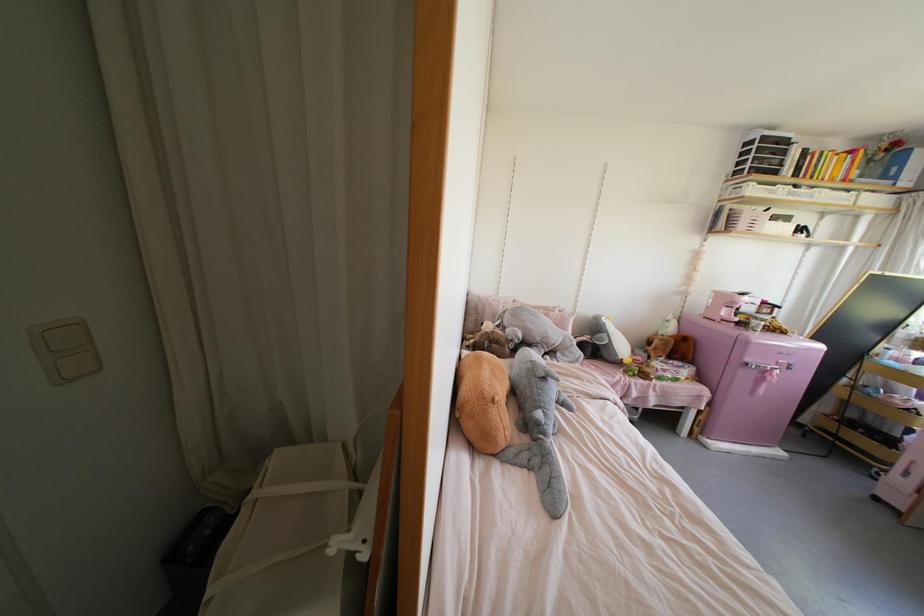
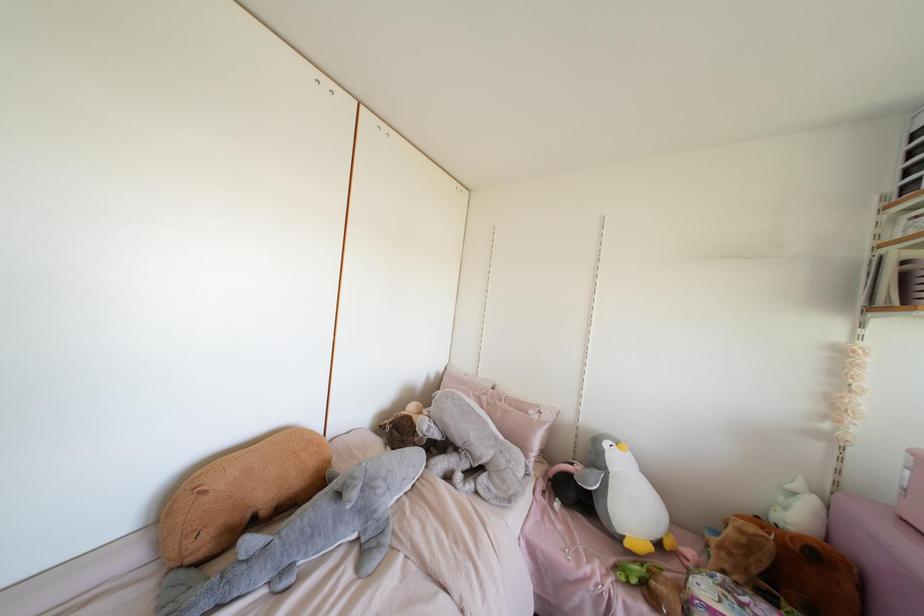
The point at [661,339] is marked in the first image. Where is the corresponding point in the second image?

(739, 531)